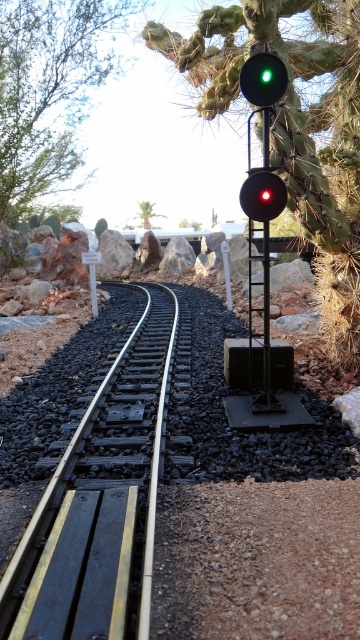
Question: Among these objects, which one is nearest to the camera?

Choices:
 (A) matte black traffic light at upper center
 (B) green glass traffic light at upper center
 (C) black metal train track at left

Answer: (C)

Question: Which point is farther to the camera?

Choices:
 (A) (249, 205)
 (B) (91, 596)

Answer: (A)

Question: Is black metal train track at left to the left of green glass traffic light at upper center from the viewer's perspective?

Choices:
 (A) yes
 (B) no

Answer: (A)

Question: Does green glass traffic light at upper center appear on the right side of matte black traffic light at upper center?

Choices:
 (A) yes
 (B) no

Answer: (B)

Question: Is black metal train track at left to the right of green glass traffic light at upper center from the viewer's perspective?

Choices:
 (A) yes
 (B) no

Answer: (B)

Question: Estimate the real-world distances between objects in this image. Which object is closer to the black metal train track at left?

Choices:
 (A) green glass traffic light at upper center
 (B) matte black traffic light at upper center

Answer: (B)